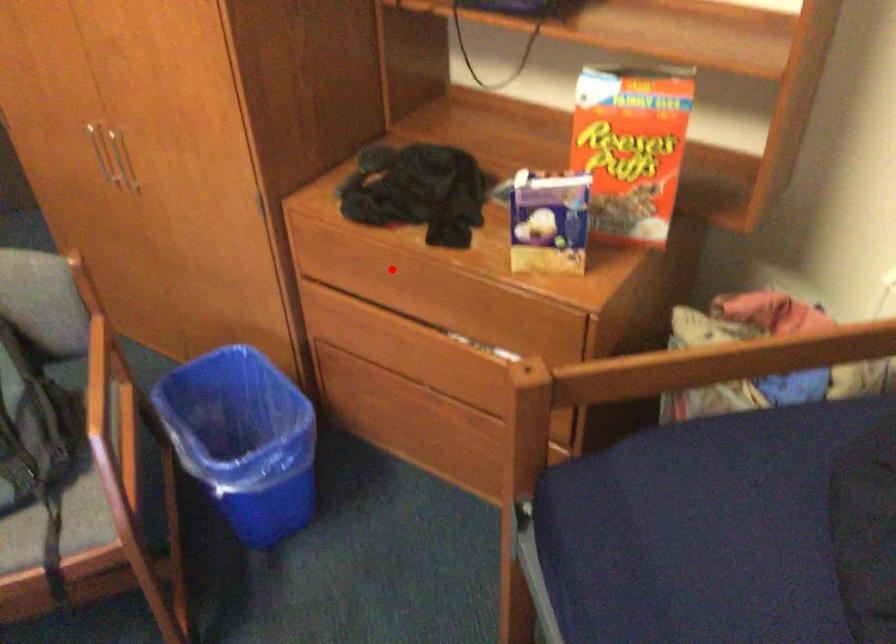
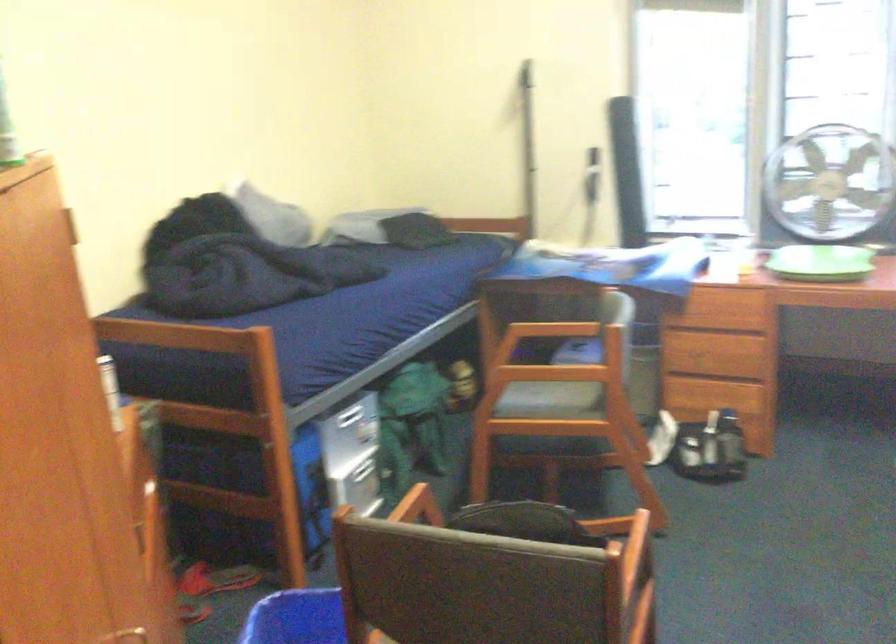
Question: I am providing you with two images of the same scene from different viewpoints. A red point is marked on the first image. At the location where the point appears in image 1, is it still visible in image 2?

Choices:
 (A) Yes
 (B) No

Answer: (B)